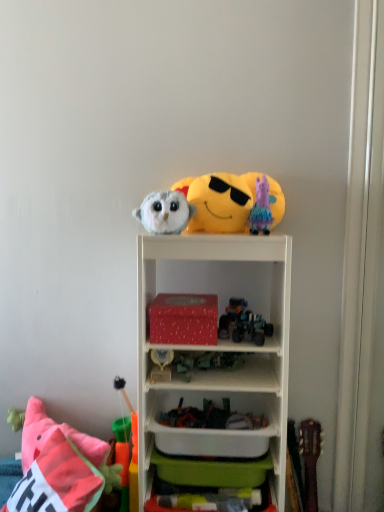
You are a GUI agent. You are given a task and a screenshot of the screen. Output one action in this format:
    pyautogui.click(x=<x>, y=<y>)
    Task: Click on the free space above red matte box at center (from a real-world perspective)
    
    Given the screenshot: What is the action you would take?
    pyautogui.click(x=187, y=298)